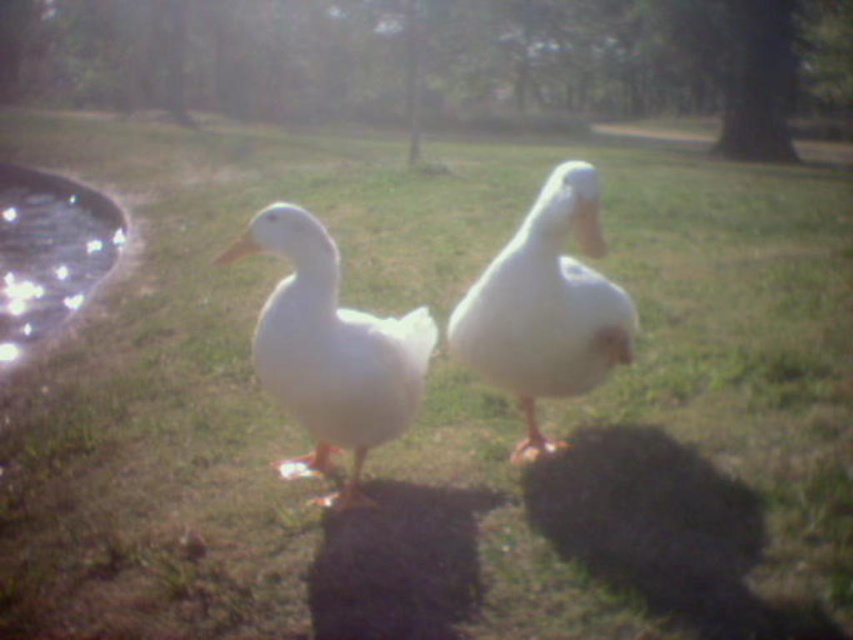
Question: Is white matte duck at center further to camera compared to glistening glass pond at left?

Choices:
 (A) yes
 (B) no

Answer: (B)

Question: Where is white matte duck at center located in relation to glistening glass pond at left in the image?

Choices:
 (A) left
 (B) right

Answer: (B)

Question: Which object is positioned farthest from the white feathered duck at center?

Choices:
 (A) white matte duck at center
 (B) glistening glass pond at left

Answer: (B)

Question: Among these objects, which one is farthest from the camera?

Choices:
 (A) white feathered duck at center
 (B) white matte duck at center

Answer: (B)

Question: Does white feathered duck at center come in front of white matte duck at center?

Choices:
 (A) no
 (B) yes

Answer: (B)

Question: Which point is farther to the camera?

Choices:
 (A) white feathered duck at center
 (B) glistening glass pond at left

Answer: (B)